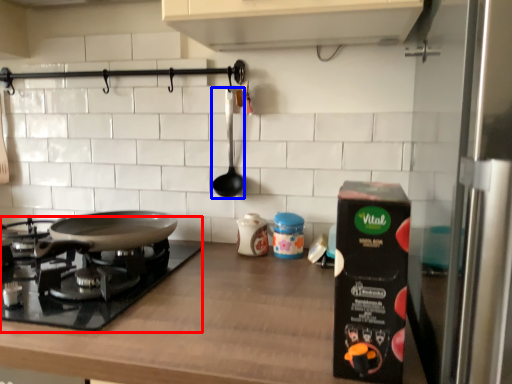
Question: Which point is closer to the camera, gas stove (highlighted by a red box) or utensil (highlighted by a blue box)?

Choices:
 (A) gas stove
 (B) utensil

Answer: (A)